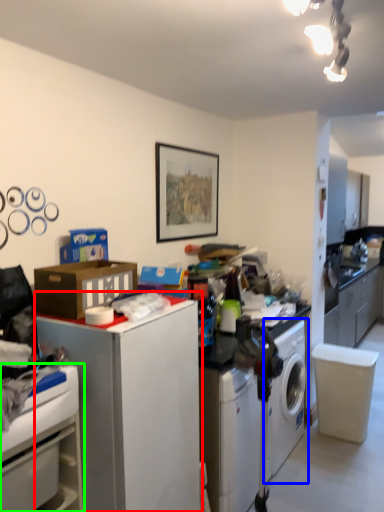
Question: Which object is the farthest from file cabinet (highlighted by a red box)? Choose among these: washing machine (highlighted by a blue box) or cabinetry (highlighted by a green box).

Choices:
 (A) washing machine
 (B) cabinetry

Answer: (A)